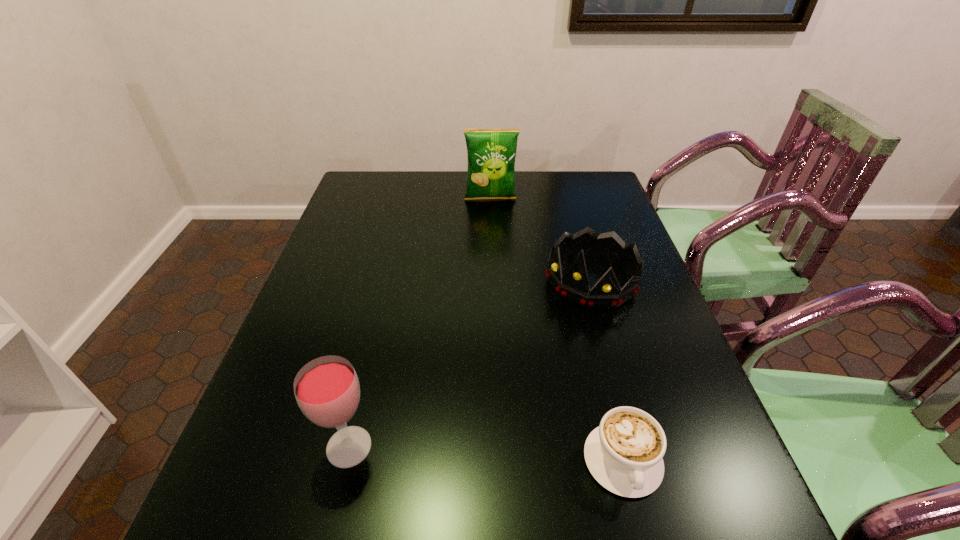
Locate an element on the screen. free space on the desktop that is between the second tallest object and the shortest object and is positioned on the front-facing side of the farthest object is located at coordinates click(x=515, y=456).

I want to click on vacant space on the desktop that is between the second tallest object and the cappuccino and is positioned at the front of the tiara with jewels, so click(459, 453).